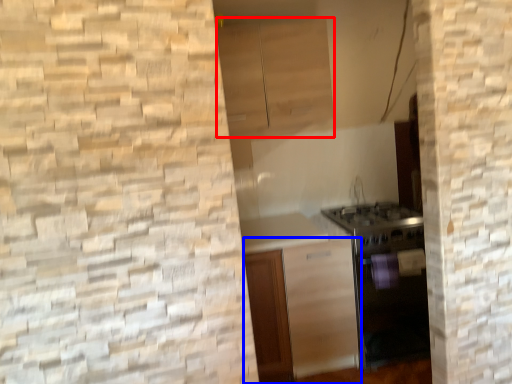
Question: Which point is closer to the camera, cabinetry (highlighted by a red box) or cabinetry (highlighted by a blue box)?

Choices:
 (A) cabinetry
 (B) cabinetry

Answer: (B)